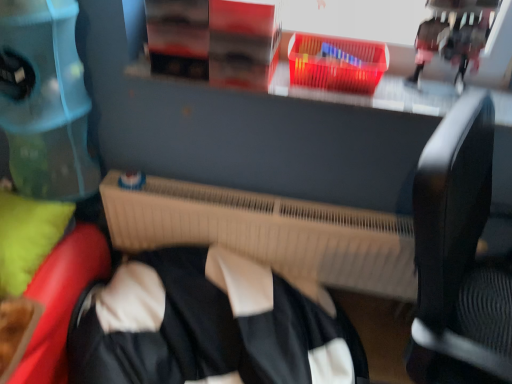
Question: Is green fabric pillow at lower left placed right next to beige plastic radiator at center?

Choices:
 (A) yes
 (B) no

Answer: (B)

Question: Considering the relative positions of green fabric pillow at lower left and beige plastic radiator at center in the image provided, is green fabric pillow at lower left to the left of beige plastic radiator at center from the viewer's perspective?

Choices:
 (A) yes
 (B) no

Answer: (A)

Question: From the image's perspective, is green fabric pillow at lower left above beige plastic radiator at center?

Choices:
 (A) yes
 (B) no

Answer: (A)

Question: Is green fabric pillow at lower left to the right of beige plastic radiator at center from the viewer's perspective?

Choices:
 (A) no
 (B) yes

Answer: (A)

Question: Considering the relative sizes of green fabric pillow at lower left and beige plastic radiator at center in the image provided, is green fabric pillow at lower left thinner than beige plastic radiator at center?

Choices:
 (A) yes
 (B) no

Answer: (B)

Question: Visually, is green fabric pillow at lower left positioned to the left or to the right of translucent plastic basket at upper center?

Choices:
 (A) left
 (B) right

Answer: (A)

Question: Would you say green fabric pillow at lower left is inside or outside translucent plastic basket at upper center?

Choices:
 (A) inside
 (B) outside

Answer: (B)

Question: Is green fabric pillow at lower left taller or shorter than translucent plastic basket at upper center?

Choices:
 (A) tall
 (B) short

Answer: (A)

Question: Is point (36, 200) closer or farther from the camera than point (330, 64)?

Choices:
 (A) farther
 (B) closer

Answer: (A)

Question: From the image's perspective, is translucent plastic basket at upper center above or below black matte jacket at center?

Choices:
 (A) below
 (B) above

Answer: (B)

Question: Which is correct: translucent plastic basket at upper center is inside black matte jacket at center, or outside of it?

Choices:
 (A) inside
 (B) outside

Answer: (B)

Question: Is translucent plastic basket at upper center taller or shorter than black matte jacket at center?

Choices:
 (A) tall
 (B) short

Answer: (B)

Question: Would you say translucent plastic basket at upper center is to the left or to the right of black matte jacket at center in the picture?

Choices:
 (A) right
 (B) left

Answer: (A)

Question: From a real-world perspective, is translucent plastic basket at upper center positioned above or below green fabric pillow at lower left?

Choices:
 (A) above
 (B) below

Answer: (A)

Question: From the image's perspective, relative to green fabric pillow at lower left, is translucent plastic basket at upper center above or below?

Choices:
 (A) above
 (B) below

Answer: (A)